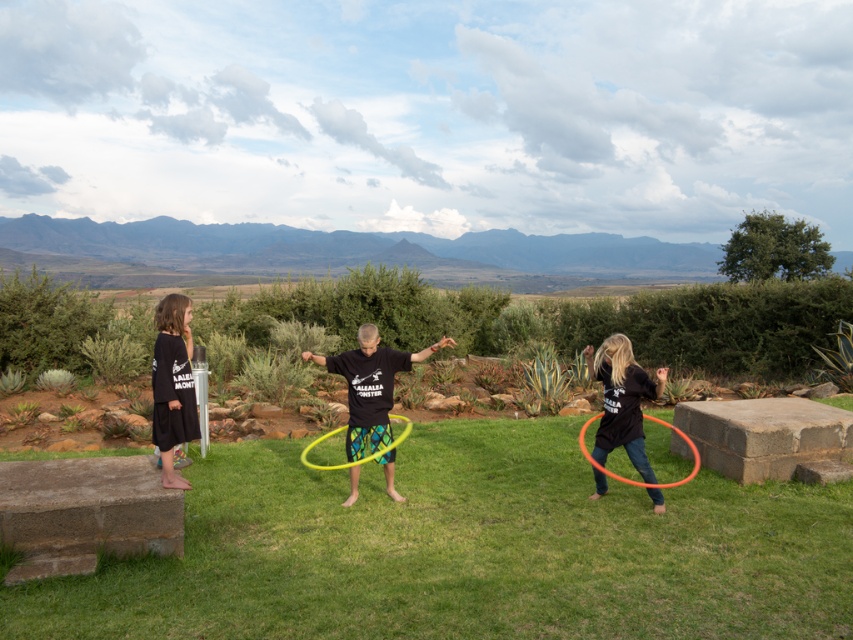
You are a photographer trying to capture the children playing with the hula hoops. You notice a point at coordinates [370,385] in the image. What object is located at this point?

The point at coordinates [370,385] corresponds to the matte black t shirt at center.

You are a photographer trying to capture the children playing with the hula hoops. You notice the black cotton shirt at left and the yellow plastic hula hoop at center. Which object is located to the left of the other?

→ The black cotton shirt at left is positioned on the left side of yellow plastic hula hoop at center, so the black cotton shirt at left is to the left of the yellow plastic hula hoop at center.